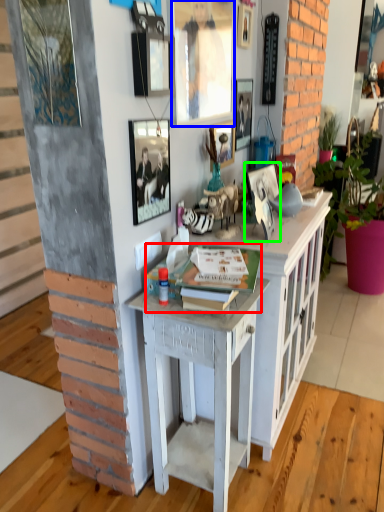
Question: Estimate the real-world distances between objects in this image. Which object is farther from book (highlighted by a red box), picture frame (highlighted by a blue box) or picture frame (highlighted by a green box)?

Choices:
 (A) picture frame
 (B) picture frame

Answer: (A)